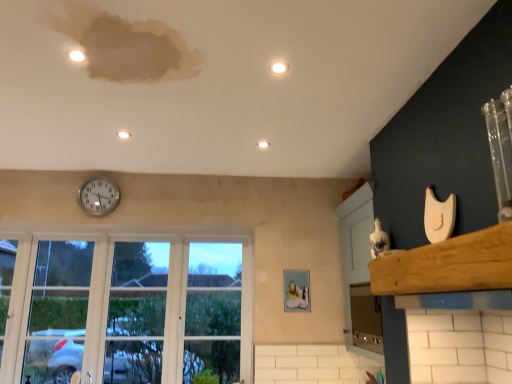
Question: Can you confirm if silver metallic clock at upper center is positioned to the left of matte white light at upper center, positioned as the 2th light in top-to-bottom order?

Choices:
 (A) no
 (B) yes

Answer: (B)

Question: Would you consider silver metallic clock at upper center to be distant from matte white light at upper center, placed as the 2th light when sorted from front to back?

Choices:
 (A) no
 (B) yes

Answer: (A)

Question: Can you confirm if silver metallic clock at upper center is bigger than matte white light at upper center, positioned as the 2th light in top-to-bottom order?

Choices:
 (A) no
 (B) yes

Answer: (B)

Question: Is silver metallic clock at upper center positioned with its back to matte white light at upper center, acting as the 2th light starting from the back?

Choices:
 (A) yes
 (B) no

Answer: (B)

Question: Is silver metallic clock at upper center next to matte white light at upper center, acting as the 2th light starting from the back?

Choices:
 (A) yes
 (B) no

Answer: (B)

Question: From the image's perspective, is white glossy light at upper center, the 3th light in the bottom-to-top sequence, positioned above or below satin silver oven at lower right?

Choices:
 (A) above
 (B) below

Answer: (A)

Question: In terms of size, does white glossy light at upper center, which is the 1th light in right-to-left order, appear bigger or smaller than satin silver oven at lower right?

Choices:
 (A) small
 (B) big

Answer: (A)

Question: From a real-world perspective, is white glossy light at upper center, the 1th light viewed from the top, above or below satin silver oven at lower right?

Choices:
 (A) above
 (B) below

Answer: (A)

Question: Visually, is white glossy light at upper center, which is counted as the 3th light, starting from the left, positioned to the left or to the right of satin silver oven at lower right?

Choices:
 (A) left
 (B) right

Answer: (A)

Question: Is wooden at upper right in front of or behind satin silver oven at lower right in the image?

Choices:
 (A) front
 (B) behind

Answer: (A)

Question: Does point (455, 261) appear closer or farther from the camera than point (370, 326)?

Choices:
 (A) closer
 (B) farther

Answer: (A)

Question: Is wooden at upper right wider or thinner than satin silver oven at lower right?

Choices:
 (A) thin
 (B) wide

Answer: (A)

Question: Looking at the image, does wooden at upper right seem bigger or smaller compared to satin silver oven at lower right?

Choices:
 (A) big
 (B) small

Answer: (B)

Question: Does point (376, 266) appear closer or farther from the camera than point (116, 132)?

Choices:
 (A) farther
 (B) closer

Answer: (B)

Question: Looking at their shapes, would you say wooden at upper right is wider or thinner than matte white light at upper center, acting as the third light starting from the right?

Choices:
 (A) wide
 (B) thin

Answer: (A)